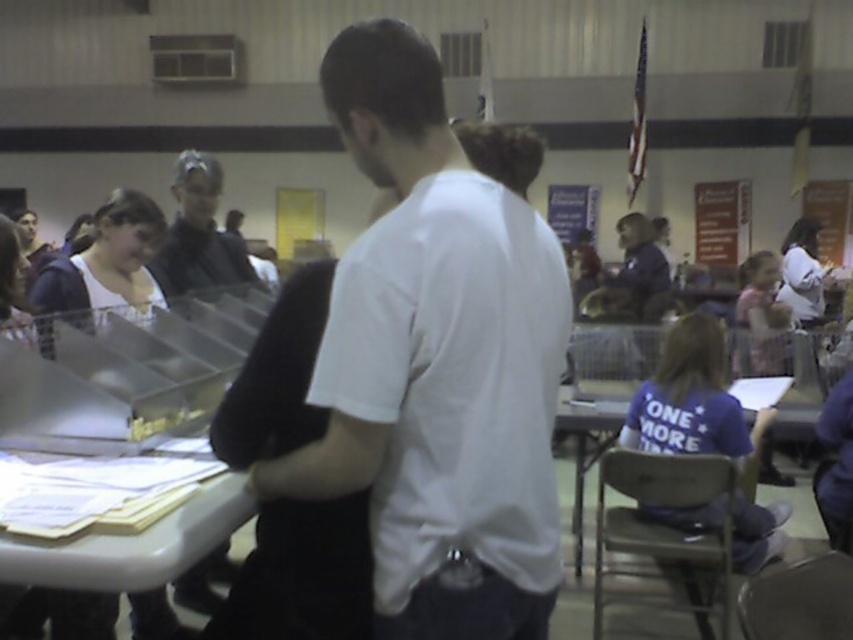
Question: Which point is closer to the camera taking this photo?

Choices:
 (A) [x=166, y=266]
 (B) [x=194, y=620]
 (C) [x=496, y=417]

Answer: (C)

Question: Among these points, which one is farthest from the camera?

Choices:
 (A) (181, 282)
 (B) (125, 628)
 (C) (642, 228)

Answer: (C)

Question: Is wooden table at lower right positioned before dark blue shirt at center?

Choices:
 (A) yes
 (B) no

Answer: (A)

Question: Estimate the real-world distances between objects in this image. Which object is farther from the matte black shirt at upper left?

Choices:
 (A) white plastic table at lower left
 (B) white matte shirt at center

Answer: (B)

Question: Can you confirm if white matte shirt at center is wider than dark blue shirt at center?

Choices:
 (A) no
 (B) yes

Answer: (B)

Question: Is white matte shirt at center to the left of white plastic table at lower left from the viewer's perspective?

Choices:
 (A) yes
 (B) no

Answer: (B)